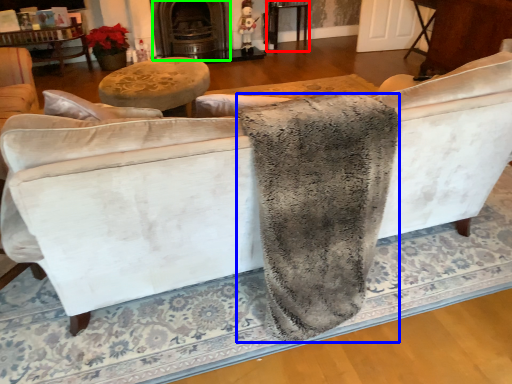
Question: Which object is the farthest from table (highlighted by a red box)? Choose among these: blanket (highlighted by a blue box) or fireplace (highlighted by a green box).

Choices:
 (A) blanket
 (B) fireplace

Answer: (A)